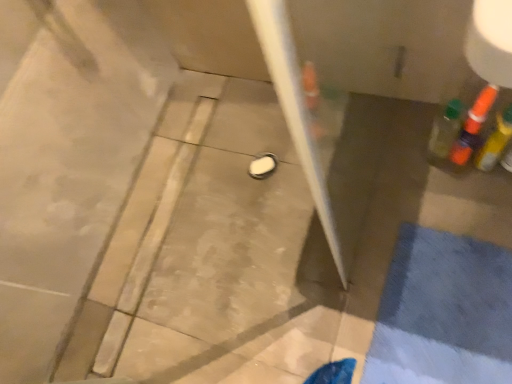
What are the coordinates of `free point behind translucent orange bottle at right, arranged as the 3th bottle when viewed from the left` in the screenshot? It's located at (416, 123).